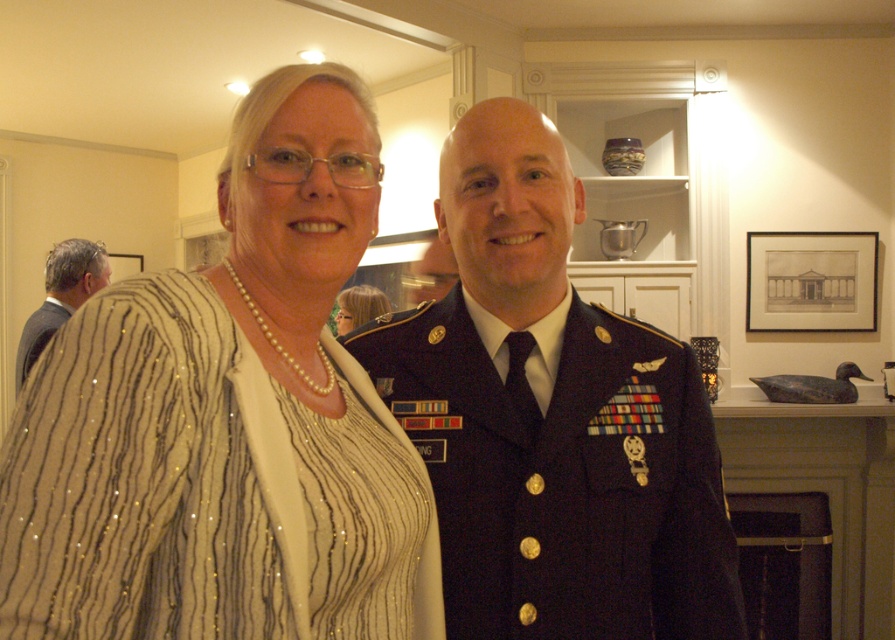
Question: From the image, what is the correct spatial relationship of black matte picture frame at upper center in relation to dark suit at left?

Choices:
 (A) right
 (B) left

Answer: (A)

Question: Which of the following is the closest to the observer?

Choices:
 (A) (866, 276)
 (B) (277, 92)
 (C) (60, 301)
 (D) (568, 540)

Answer: (B)

Question: Does black matte picture frame at upper center have a smaller size compared to dark suit at left?

Choices:
 (A) no
 (B) yes

Answer: (B)

Question: Can you confirm if navy blue uniform at center is bigger than dark suit at left?

Choices:
 (A) yes
 (B) no

Answer: (B)

Question: Which of these objects is positioned closest to the sequined fabric jacket at center?

Choices:
 (A) black matte picture frame at upper center
 (B) navy blue uniform at center
 (C) pearl necklace at upper center

Answer: (B)

Question: Among these objects, which one is farthest from the camera?

Choices:
 (A) pearl necklace at upper center
 (B) dark suit at left

Answer: (A)